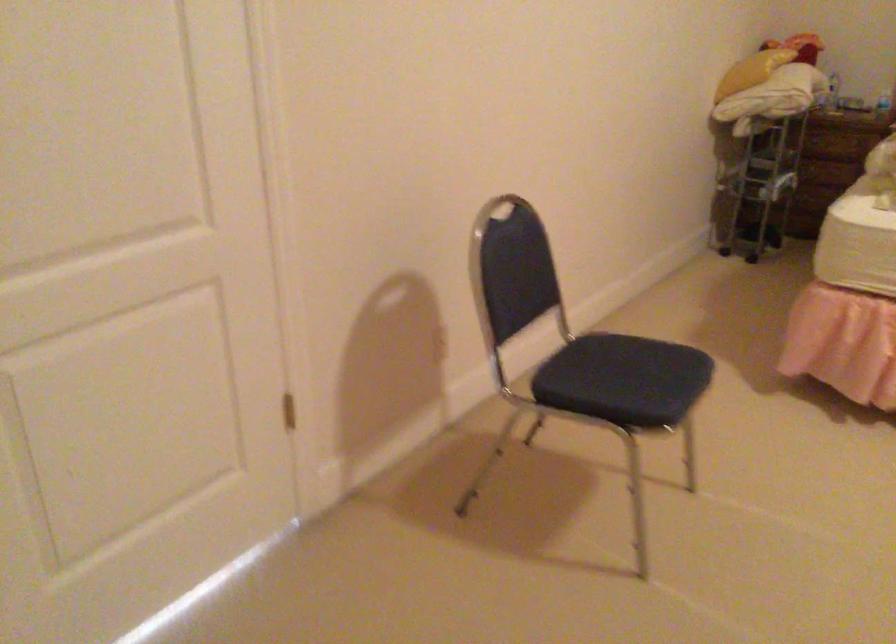
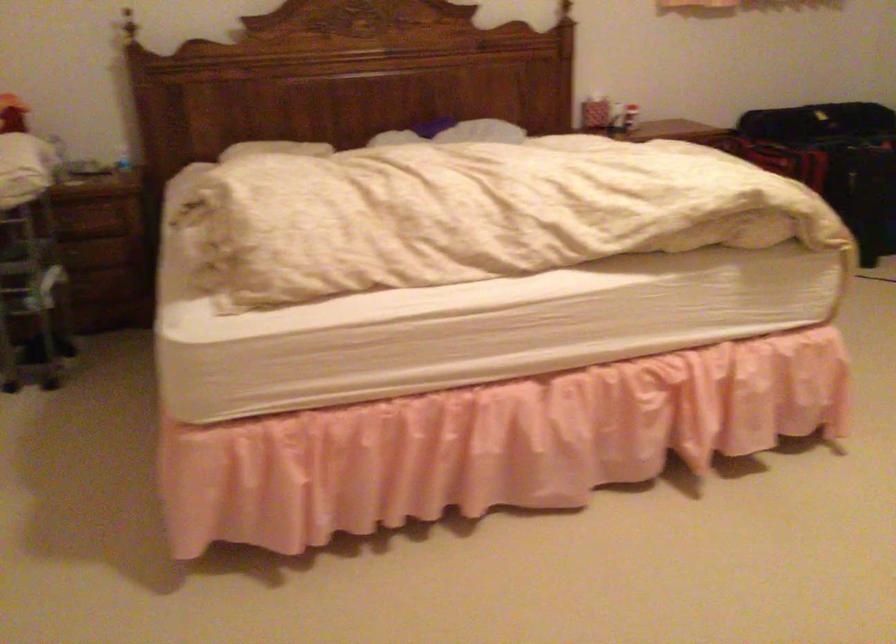
The point at (x=807, y=69) is marked in the first image. Where is the corresponding point in the second image?

(59, 158)